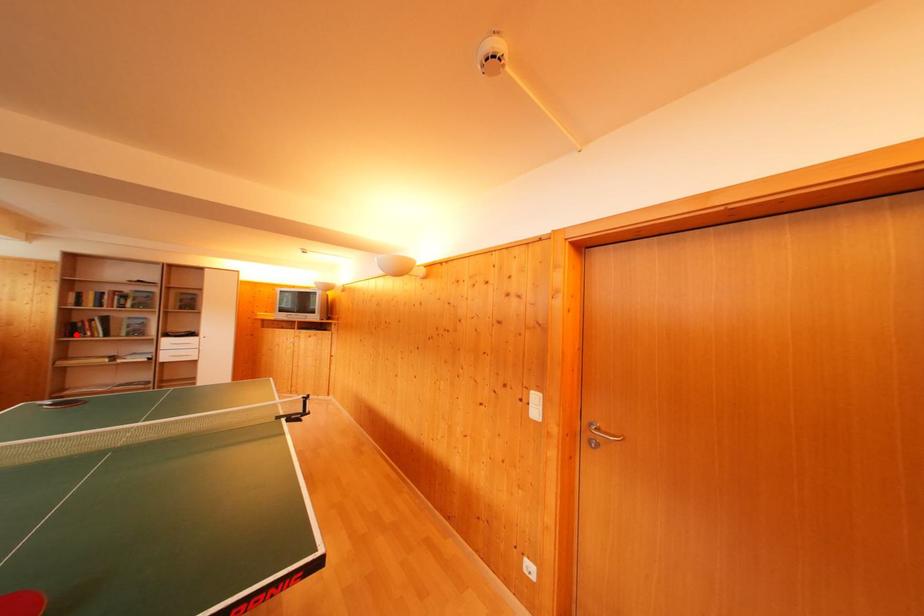
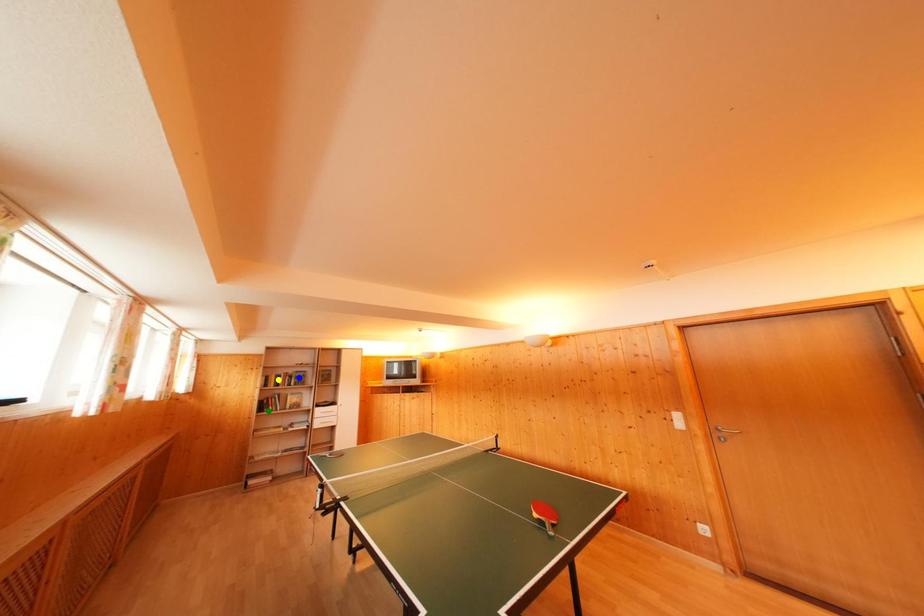
Question: I am providing you with two images of the same scene from different viewpoints. A red point is marked on the first image. You are given multiple points on the second image. Which point in image 2 is actually the same real-world point as the red point in image 1?

Choices:
 (A) yellow point
 (B) green point
 (C) blue point

Answer: (B)